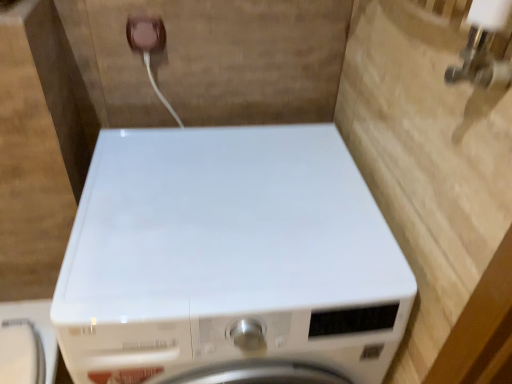
This screenshot has width=512, height=384. Identify the location of blank space situated above white glossy washing machine at center (from a real-world perspective). [208, 242].